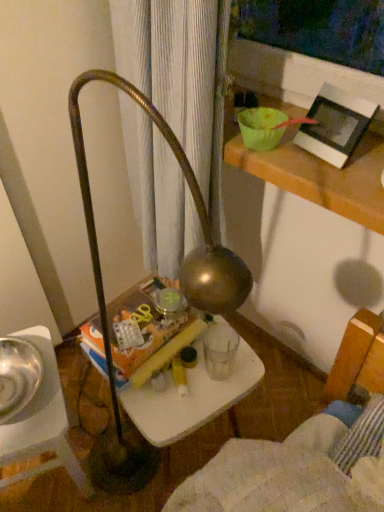
Question: Is metallic silver bowl at lower left placed right next to white matte picture frame at upper right?

Choices:
 (A) no
 (B) yes

Answer: (A)

Question: From the image's perspective, is metallic silver bowl at lower left beneath white matte picture frame at upper right?

Choices:
 (A) yes
 (B) no

Answer: (A)

Question: Is white matte picture frame at upper right located within metallic silver bowl at lower left?

Choices:
 (A) yes
 (B) no

Answer: (B)

Question: Is metallic silver bowl at lower left positioned beyond the bounds of white matte picture frame at upper right?

Choices:
 (A) no
 (B) yes

Answer: (B)

Question: Is metallic silver bowl at lower left shorter than white matte picture frame at upper right?

Choices:
 (A) yes
 (B) no

Answer: (B)

Question: Is white plastic table at center bigger or smaller than white matte picture frame at upper right?

Choices:
 (A) big
 (B) small

Answer: (A)

Question: Based on their positions, is white plastic table at center located to the left or right of white matte picture frame at upper right?

Choices:
 (A) left
 (B) right

Answer: (A)

Question: Is white plastic table at center spatially inside white matte picture frame at upper right, or outside of it?

Choices:
 (A) inside
 (B) outside

Answer: (B)

Question: Is point (172, 425) closer or farther from the camera than point (360, 136)?

Choices:
 (A) closer
 (B) farther

Answer: (B)

Question: Based on their sizes in the image, would you say metallic silver bowl at lower left is bigger or smaller than white plastic table at center?

Choices:
 (A) small
 (B) big

Answer: (A)

Question: From the image's perspective, relative to white plastic table at center, is metallic silver bowl at lower left above or below?

Choices:
 (A) above
 (B) below

Answer: (B)

Question: From their relative heights in the image, would you say metallic silver bowl at lower left is taller or shorter than white plastic table at center?

Choices:
 (A) tall
 (B) short

Answer: (A)

Question: Would you say metallic silver bowl at lower left is to the left or to the right of white plastic table at center in the picture?

Choices:
 (A) right
 (B) left

Answer: (B)

Question: Considering the positions of shiny metallic bowl at left and white plastic table at center in the image, is shiny metallic bowl at left wider or thinner than white plastic table at center?

Choices:
 (A) wide
 (B) thin

Answer: (B)

Question: In terms of height, does shiny metallic bowl at left look taller or shorter compared to white plastic table at center?

Choices:
 (A) tall
 (B) short

Answer: (B)